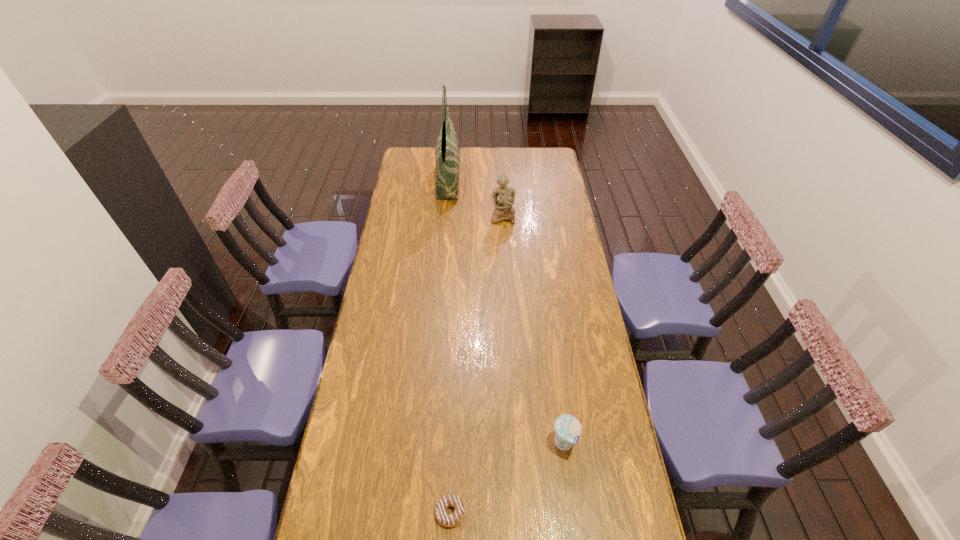
Where is `the farthest object`? This screenshot has height=540, width=960. the farthest object is located at coordinates (447, 151).

The image size is (960, 540). What are the coordinates of `tote bag` in the screenshot? It's located at (447, 151).

This screenshot has width=960, height=540. Identify the location of the third object from left to right. (504, 196).

Locate an element on the screen. This screenshot has height=540, width=960. the third nearest object is located at coordinates (504, 196).

At what (x,y) coordinates should I click in order to perform the action: click on the third farthest object. Please return your answer as a coordinate pair (x, y). The image size is (960, 540). Looking at the image, I should click on (567, 428).

The height and width of the screenshot is (540, 960). What are the coordinates of `yogurt` in the screenshot? It's located at (567, 428).

Identify the location of the shortest object. (445, 519).

At what (x,y) coordinates should I click in order to perform the action: click on doughnut. Please return your answer as a coordinate pair (x, y). Looking at the image, I should click on (445, 519).

This screenshot has width=960, height=540. I want to click on vacant space located 0.060m on the left of the tote bag, so click(424, 179).

Locate an element on the screen. vacant area situated 0.050m on the front-facing side of the second tallest object is located at coordinates (504, 231).